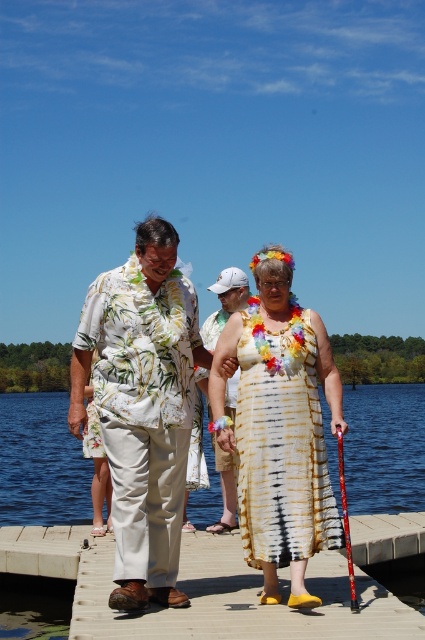
Question: Does floral fabric shirt at center come behind wooden at center?

Choices:
 (A) yes
 (B) no

Answer: (A)

Question: Is wooden at center to the right of blue water at lower center from the viewer's perspective?

Choices:
 (A) yes
 (B) no

Answer: (A)

Question: Among these points, which one is farthest from the camera?

Choices:
 (A) (116, 324)
 (B) (215, 330)

Answer: (B)

Question: Which point is farther to the camera?

Choices:
 (A) (125, 376)
 (B) (210, 628)
 (C) (30, 506)

Answer: (C)

Question: Which point is farther from the camera taking this photo?

Choices:
 (A) (96, 397)
 (B) (405, 616)
 (C) (302, 424)
 (D) (376, 458)

Answer: (D)

Question: Can you confirm if blue water at lower center is bigger than white floral shirt at center?

Choices:
 (A) yes
 (B) no

Answer: (A)